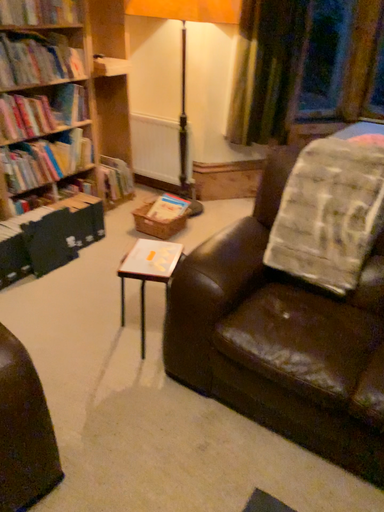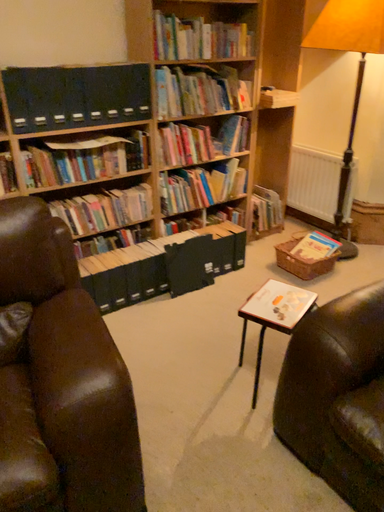
Question: Which way did the camera rotate in the video?

Choices:
 (A) rotated left
 (B) rotated right

Answer: (A)